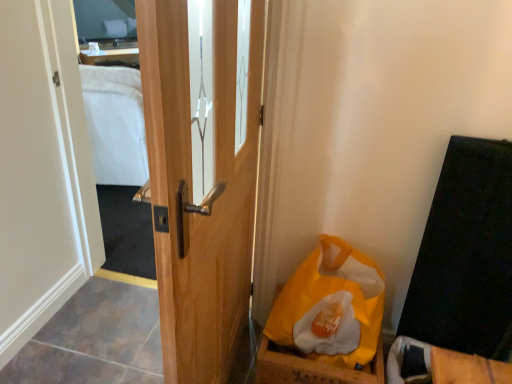
Find the location of `vacant point to the left of wooden door at center`. vacant point to the left of wooden door at center is located at coordinates (101, 340).